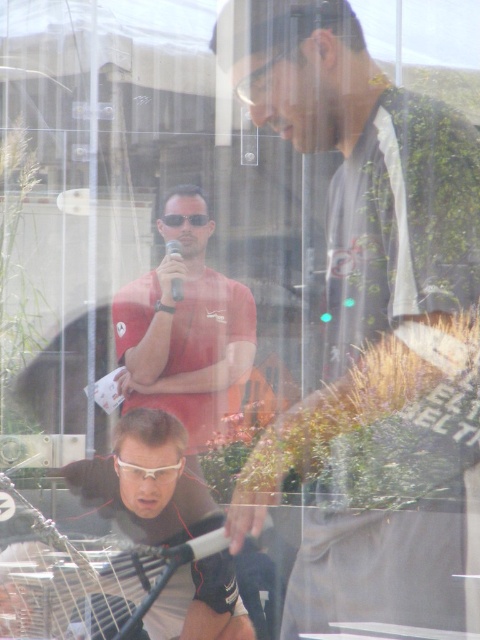
You are a photographer trying to capture a clear shot of the matte red shirt at center and the white plastic goggles at lower center. Since the image is taken through a glass surface, which object might appear more distorted in the photo due to its size?

The matte red shirt at center is bigger than the white plastic goggles at lower center, so it might appear more distorted in the photo due to its larger size.

You are a photographer trying to capture a clear shot of the matte red shirt at center and the white plastic goggles at lower center. Which object should you focus on first to ensure both are in sharp focus?

The matte red shirt at center is closer to the viewer than the white plastic goggles at lower center. To ensure both are in sharp focus, you should focus on the matte red shirt at center first, as it is the closer object.